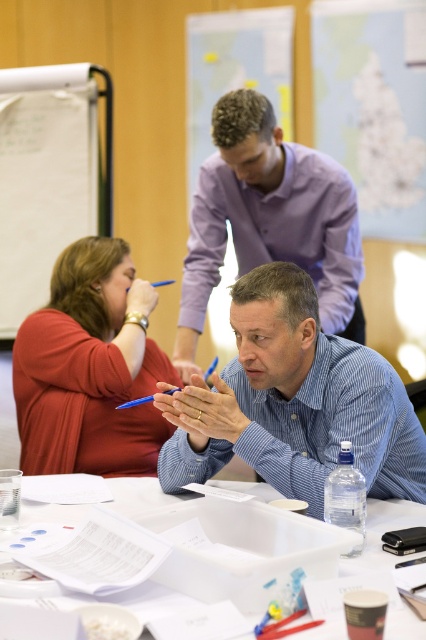
Does white paper at upper left have a greater width compared to white plastic tray at center?

No.

Does white paper at upper left have a smaller size compared to white plastic tray at center?

Actually, white paper at upper left might be larger than white plastic tray at center.

What do you see at coordinates (43, 179) in the screenshot?
I see `white paper at upper left` at bounding box center [43, 179].

You are a GUI agent. You are given a task and a screenshot of the screen. Output one action in this format:
    pyautogui.click(x=<x>, y=<y>)
    Task: Click on the white paper at upper left
    The width and height of the screenshot is (426, 640).
    Given the screenshot: What is the action you would take?
    pyautogui.click(x=43, y=179)

Can you confirm if purple cotton dress shirt at upper center is smaller than white paper at upper left?

Actually, purple cotton dress shirt at upper center might be larger than white paper at upper left.

Identify the location of purple cotton dress shirt at upper center. The width and height of the screenshot is (426, 640). (268, 220).

Is matte orange shirt at center below white paper at upper left?

Indeed, matte orange shirt at center is positioned under white paper at upper left.

Which is behind, point (34, 380) or point (95, 170)?

The point (95, 170) is more distant.

Find the location of `matte orange shirt at center`. matte orange shirt at center is located at coordinates (86, 371).